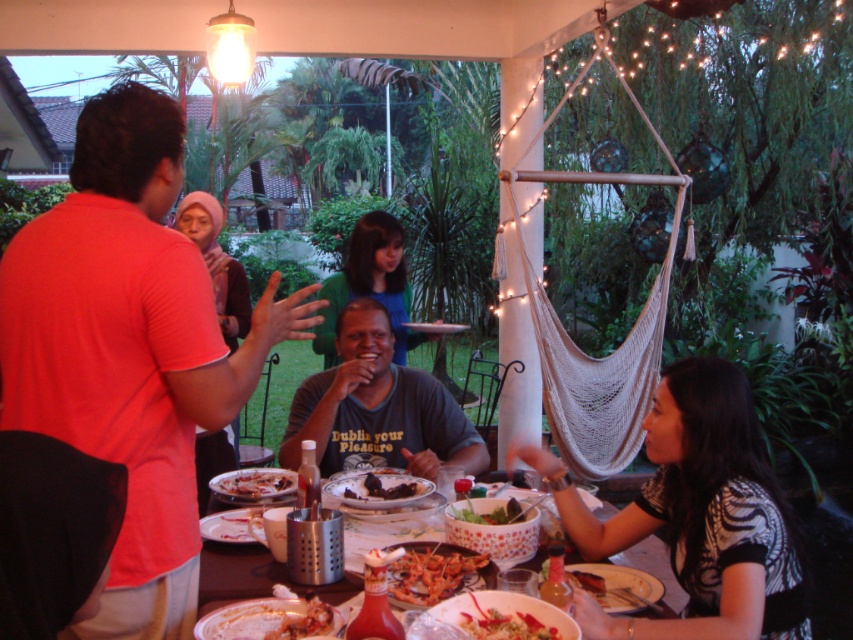
You are a guest at the gathering and want to reach for the shiny plastic fork at lower center. However, there is a green fabric shirt at center in your way. Can you easily access the fork without moving the shirt?

The green fabric shirt at center is positioned over the shiny plastic fork at lower center, so you cannot easily access the fork without moving the shirt.

You are a guest at this gathering and want to grab a slice of the dark chocolate cake at center. However, there is a person wearing a black and white printed shirt at lower right in your way. Can you easily reach the cake without moving them?

The black and white printed shirt at lower right is positioned over dark chocolate cake at center, meaning the person is directly blocking access to the cake. You would need to ask them to move or go around to reach it.

You are at a backyard gathering and want to grab the shiny plastic fork at lower center to eat pizza. However, the plastic bottle at center is blocking your access. Can you reach the fork without moving the bottle?

The shiny plastic fork at lower center is behind the plastic bottle at center, so you can reach it by moving around the bottle to access the fork from behind.